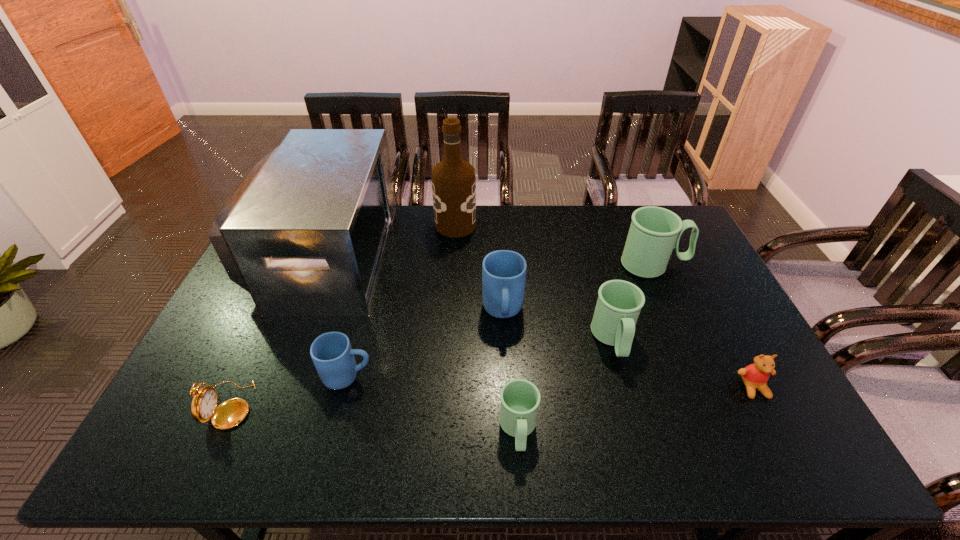
Find the location of a particular element. The width and height of the screenshot is (960, 540). the smaller blue mug is located at coordinates (332, 354).

The height and width of the screenshot is (540, 960). Find the location of `the left blue mug`. the left blue mug is located at coordinates (332, 354).

Where is `pocket watch`? The width and height of the screenshot is (960, 540). pocket watch is located at coordinates (230, 413).

The height and width of the screenshot is (540, 960). I want to click on red teddy bear, so click(755, 376).

The width and height of the screenshot is (960, 540). I want to click on the smallest green mug, so click(520, 398).

The height and width of the screenshot is (540, 960). Identify the location of the leftmost green mug. (520, 398).

I want to click on free location located on the label of the brown alcohol, so click(x=532, y=225).

This screenshot has width=960, height=540. What are the coordinates of `free space located 0.150m on the front-facing side of the microwave oven` in the screenshot? It's located at (428, 254).

Identify the location of free location located 0.070m on the side of the biggest green mug with the handle. (708, 265).

Identify the location of vacant space located 0.060m on the side of the bigger blue mug with the handle. Image resolution: width=960 pixels, height=540 pixels. (505, 352).